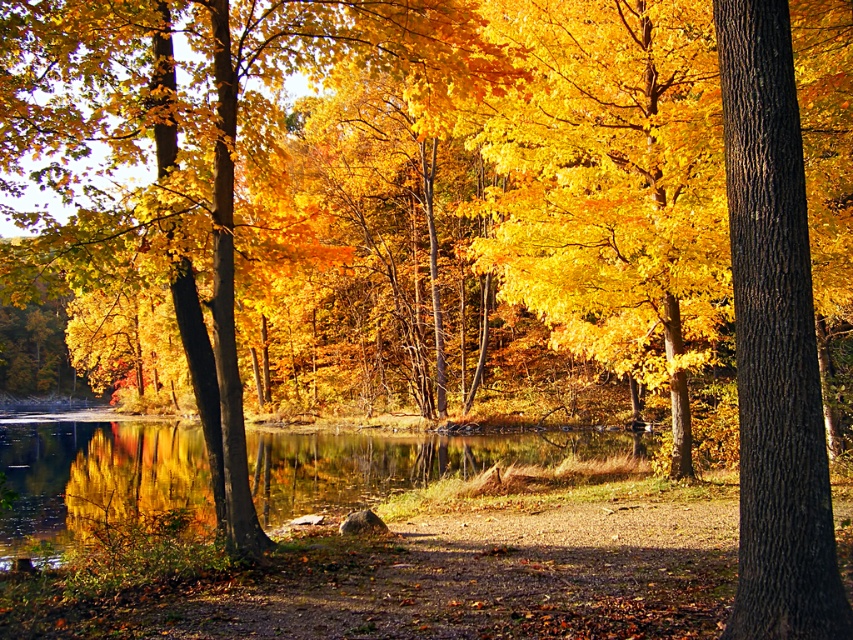
Question: Does brown rough bark tree at right have a smaller size compared to glossy reflective water at center?

Choices:
 (A) no
 (B) yes

Answer: (B)

Question: Among these objects, which one is farthest from the camera?

Choices:
 (A) brown rough bark tree at right
 (B) glossy reflective water at center

Answer: (B)

Question: Which object appears farthest from the camera in this image?

Choices:
 (A) brown rough bark tree at right
 (B) glossy reflective water at center

Answer: (B)

Question: Is brown rough bark tree at right above glossy reflective water at center?

Choices:
 (A) yes
 (B) no

Answer: (A)

Question: Considering the relative positions of brown rough bark tree at right and glossy reflective water at center in the image provided, where is brown rough bark tree at right located with respect to glossy reflective water at center?

Choices:
 (A) left
 (B) right

Answer: (B)

Question: Among these points, which one is farthest from the camera?

Choices:
 (A) (55, 554)
 (B) (746, 141)

Answer: (A)